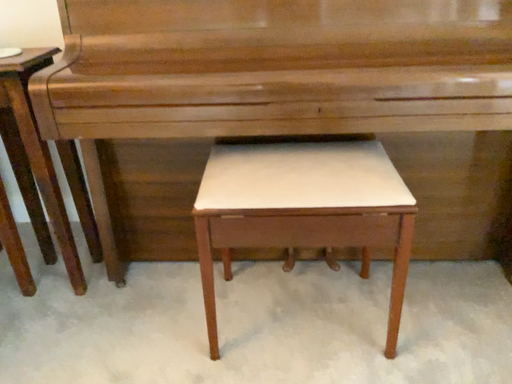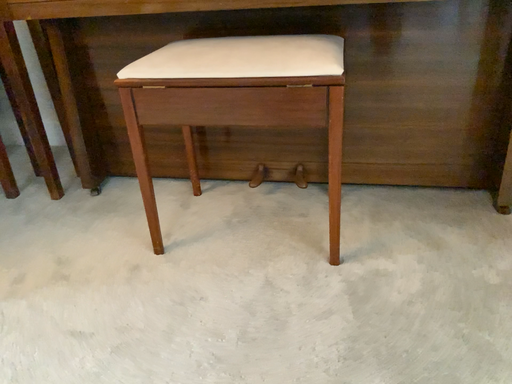
Question: Which way did the camera rotate in the video?

Choices:
 (A) rotated right
 (B) rotated left

Answer: (B)